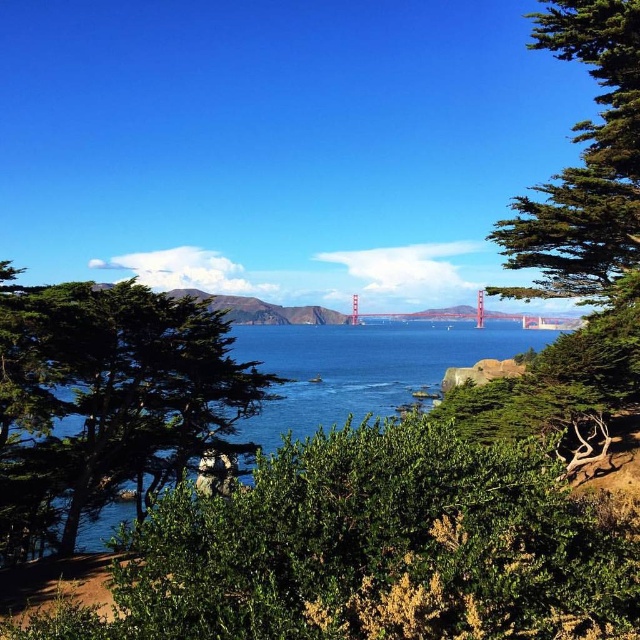
Question: Which of these objects is positioned closest to the green leafy tree at center?

Choices:
 (A) metallic bridge at center
 (B) blue liquid water at center

Answer: (B)

Question: Which of the following is the farthest from the observer?

Choices:
 (A) (616, 35)
 (B) (490, 317)
 (C) (392, 356)

Answer: (B)

Question: Is green textured tree at right closer to the viewer compared to blue liquid water at center?

Choices:
 (A) no
 (B) yes

Answer: (B)

Question: Does green textured tree at right appear on the right side of metallic bridge at center?

Choices:
 (A) yes
 (B) no

Answer: (B)

Question: Estimate the real-world distances between objects in this image. Which object is farther from the blue liquid water at center?

Choices:
 (A) green textured tree at right
 (B) green leafy tree at center

Answer: (A)

Question: Can you confirm if green textured tree at right is positioned to the right of blue liquid water at center?

Choices:
 (A) yes
 (B) no

Answer: (B)